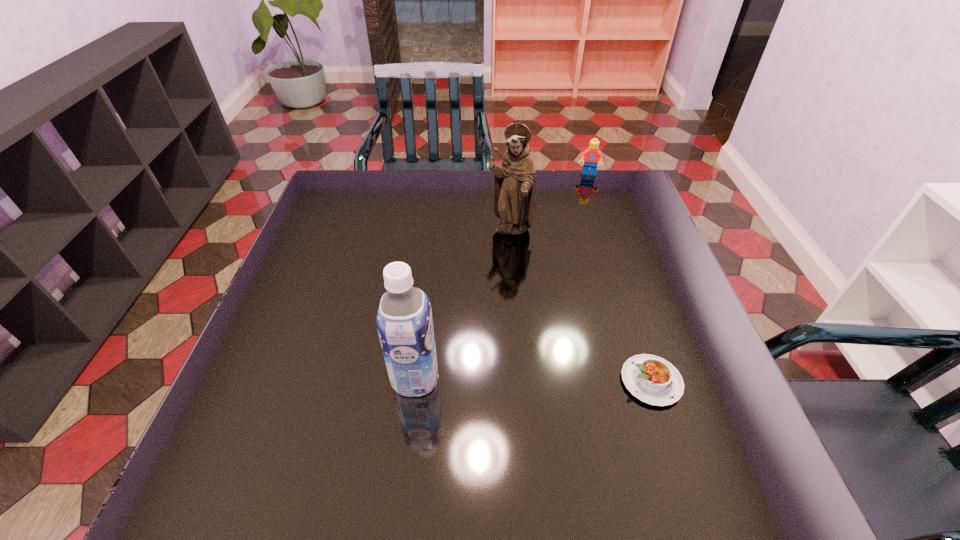
What are the coordinates of `Lego that is at the right edge` in the screenshot? It's located at (591, 156).

At what (x,y) coordinates should I click in order to perform the action: click on object located at the far right corner. Please return your answer as a coordinate pair (x, y). The image size is (960, 540). Looking at the image, I should click on (591, 156).

This screenshot has height=540, width=960. What are the coordinates of `object at the near right corner` in the screenshot? It's located at (653, 380).

At what (x,y) coordinates should I click in order to perform the action: click on free space at the far edge of the desktop. Please return your answer as a coordinate pair (x, y). This screenshot has height=540, width=960. Looking at the image, I should click on (586, 198).

This screenshot has height=540, width=960. I want to click on vacant space at the near edge of the desktop, so [x=393, y=414].

Identify the location of vacant area at the left edge of the desktop. (236, 390).

Where is `blank area at the right edge`? The width and height of the screenshot is (960, 540). blank area at the right edge is located at coordinates pyautogui.click(x=628, y=257).

In order to click on free space at the near left corner of the desktop in this screenshot , I will do `click(263, 422)`.

Identify the location of free spot at the far right corner of the desktop. The height and width of the screenshot is (540, 960). (601, 188).

Identify the location of free space between the third object from right to left and the leftmost object. The width and height of the screenshot is (960, 540). (463, 305).